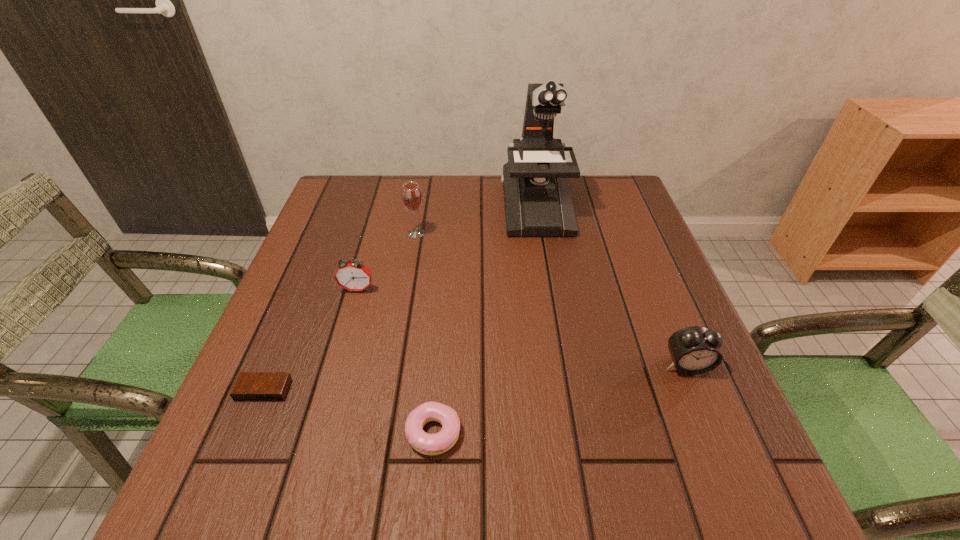
Locate which alarm clock is the second closest to the second shortest object. Please provide its 2D coordinates. Your answer should be formatted as a tuple, i.e. [(x, y)], where the tuple contains the x and y coordinates of a point satisfying the conditions above.

[(351, 275)]

This screenshot has height=540, width=960. Find the location of `vacant point that satisfies the following two spatial constraints: 1. on the front face of the leftmost alarm clock; 2. on the right side of the third object from right to left`. vacant point that satisfies the following two spatial constraints: 1. on the front face of the leftmost alarm clock; 2. on the right side of the third object from right to left is located at coordinates (246, 433).

Locate an element on the screen. The height and width of the screenshot is (540, 960). free space that satisfies the following two spatial constraints: 1. on the front face of the shortest object; 2. on the right side of the nearest object is located at coordinates (246, 433).

Identify the location of blank area in the image that satisfies the following two spatial constraints: 1. on the clock face of the fifth object from right to left; 2. on the right side of the third object from right to left. (316, 433).

At what (x,y) coordinates should I click in order to perform the action: click on vacant space that satisfies the following two spatial constraints: 1. on the clock face of the second shortest object; 2. on the left side of the second object from left to right. Please return your answer as a coordinate pair (x, y). Looking at the image, I should click on (316, 433).

Identify the location of free point that satisfies the following two spatial constraints: 1. on the front face of the fifth tallest object; 2. on the right side of the leftmost object. This screenshot has width=960, height=540. (246, 433).